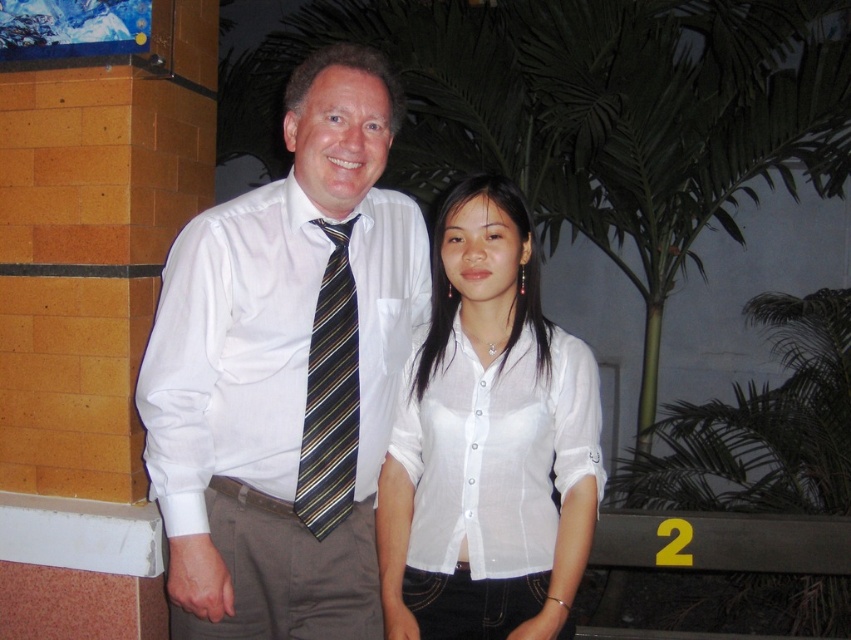
You are a photographer standing 1.2 meters away from the camera. You want to adjust your position so that you can clearly see the white shirt at center in the frame. Should you move closer or farther away from the camera?

The white shirt at center is currently 1.52 meters away from the viewer. Since you are standing 1.2 meters away from the camera, you are closer to the camera than the white shirt. To see the white shirt clearly in the frame, you should move farther away from the camera so that you are within the distance of the subject.

Consider the image. You are a photographer setting up a photo shoot. You have two outfits to place on a mannequin for a display. The first outfit is the white shirt at center, and the second is the white sheer blouse at center. If you want to choose the wider garment for the display, which one should you pick?

The white shirt at center has a greater width than the white sheer blouse at center, so you should choose the white shirt at center for the display.